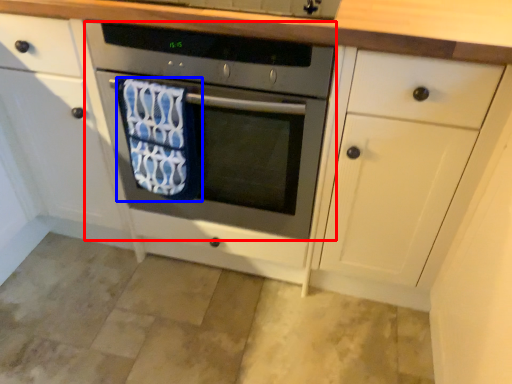
Question: Among these objects, which one is nearest to the camera, oven (highlighted by a red box) or beach towel (highlighted by a blue box)?

Choices:
 (A) oven
 (B) beach towel

Answer: (A)